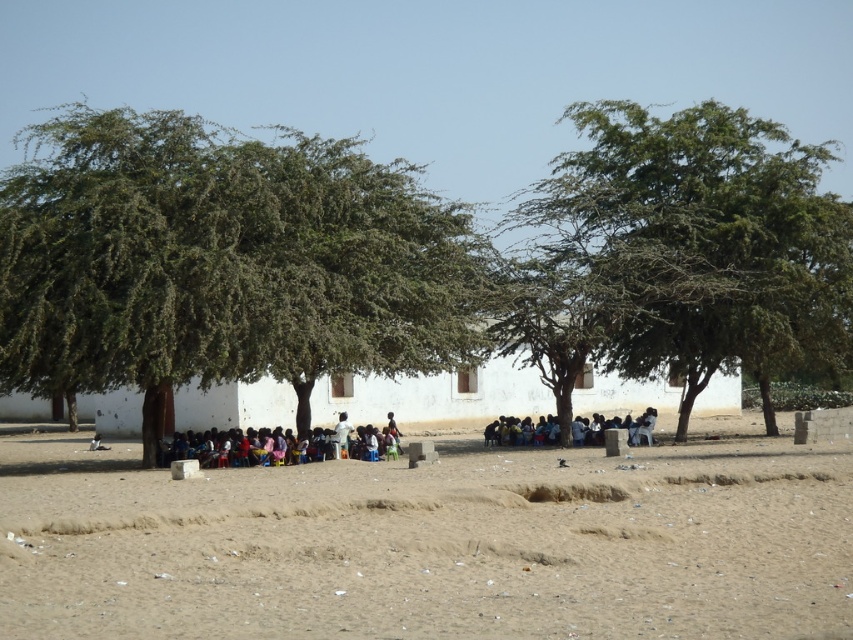
You are planning to set up a picnic area in the shade. The scene has a green leafy tree at left and a green leafy tree at center. Which tree would provide more shade for your picnic? Explain your reasoning based on the tree heights.

The green leafy tree at left is much taller than the green leafy tree at center. Taller trees generally cast larger shadows, so the green leafy tree at left would provide more shade for the picnic area.

You are standing at the edge of the scene and want to reach the group of people sitting under the trees. According to the coordinates provided, is the brown sandy dirt field at center in your path towards them?

The brown sandy dirt field at center is located at point (432, 545), which would be along your path towards the group of people under the trees, so yes, it is in your way.

You are standing in the outdoor scene under the clear blue sky. You see the white matte building at center and the dark blue fabric at center. Which object is closer to you?

The white matte building at center is closer to the viewer than the dark blue fabric at center.